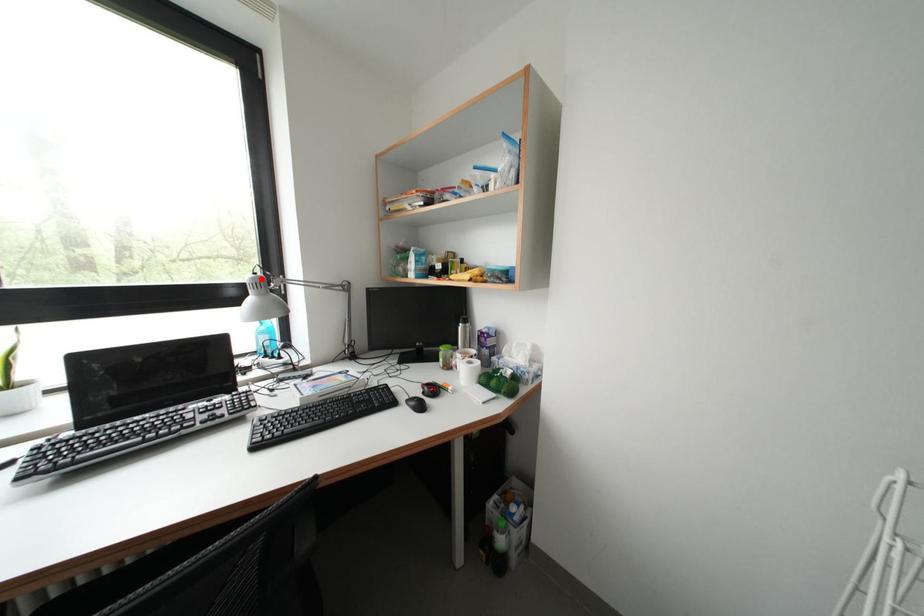
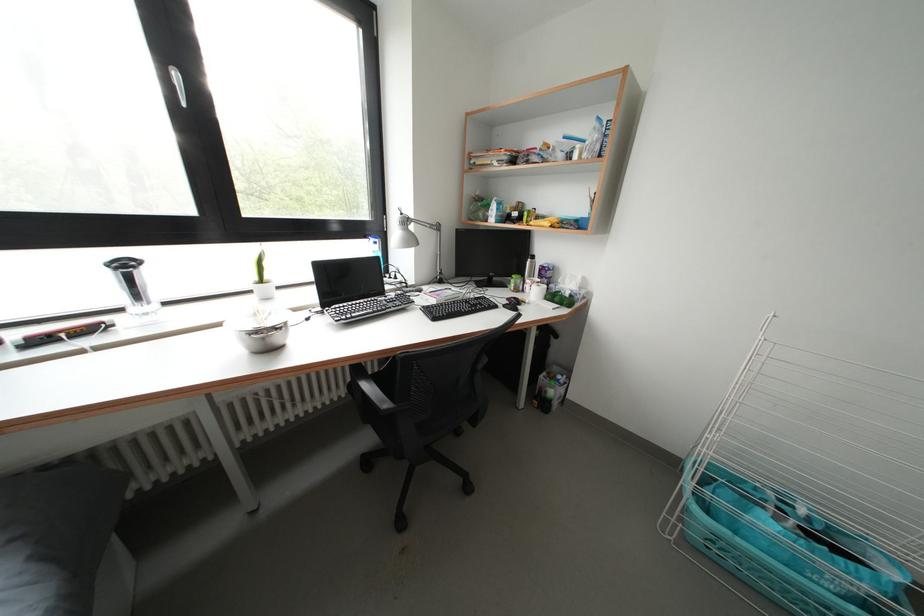
Question: A red point is marked in image1. In image2, is the corresponding 3D point closer to the camera or farther? Reply with the corresponding letter.

Choices:
 (A) The corresponding 3D point is closer.
 (B) The corresponding 3D point is farther.

Answer: (A)